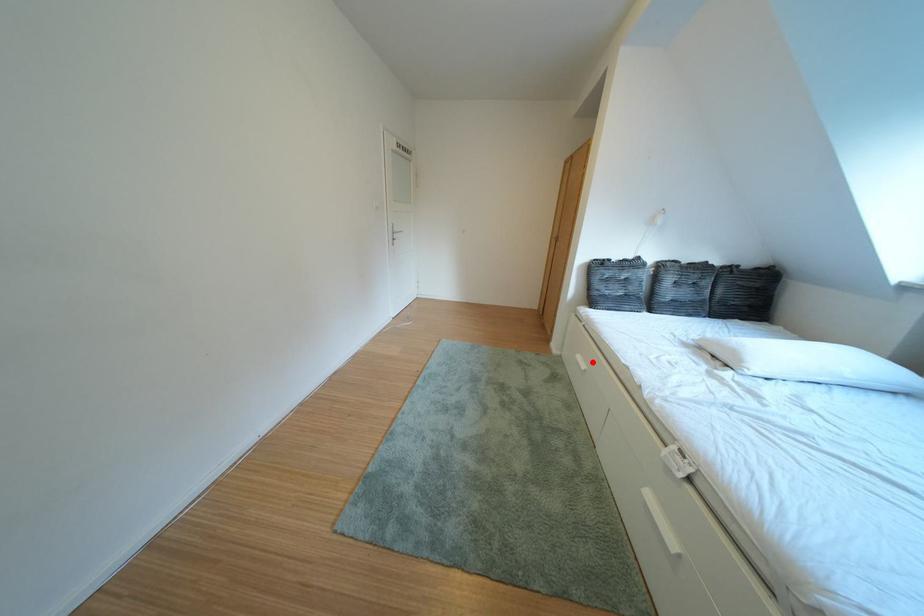
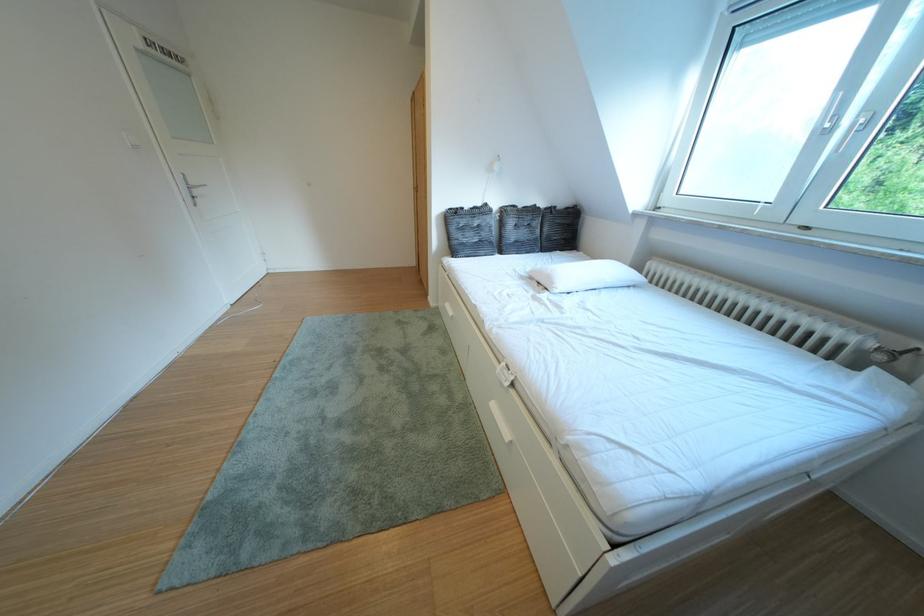
Question: I am providing you with two images of the same scene from different viewpoints. Given a red point in image1, look at the same physical point in image2. Is it:

Choices:
 (A) Closer to the viewpoint
 (B) Farther from the viewpoint

Answer: (B)